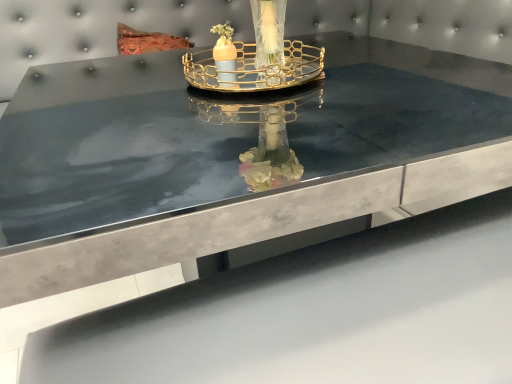
Question: Is matte orange candle at center facing towards gold metallic tray at center?

Choices:
 (A) yes
 (B) no

Answer: (B)

Question: Is matte orange candle at center wider than gold metallic tray at center?

Choices:
 (A) yes
 (B) no

Answer: (B)

Question: Considering the relative sizes of matte orange candle at center and gold metallic tray at center in the image provided, is matte orange candle at center thinner than gold metallic tray at center?

Choices:
 (A) no
 (B) yes

Answer: (B)

Question: Does matte orange candle at center have a greater height compared to gold metallic tray at center?

Choices:
 (A) no
 (B) yes

Answer: (A)

Question: Does matte orange candle at center have a smaller size compared to gold metallic tray at center?

Choices:
 (A) no
 (B) yes

Answer: (B)

Question: Is matte orange candle at center completely or partially outside of gold metallic tray at center?

Choices:
 (A) yes
 (B) no

Answer: (B)

Question: Can you confirm if gold metallic tray at center is taller than matte orange candle at center?

Choices:
 (A) no
 (B) yes

Answer: (B)

Question: Is gold metallic tray at center far from matte orange candle at center?

Choices:
 (A) no
 (B) yes

Answer: (A)

Question: Considering the relative sizes of gold metallic tray at center and matte orange candle at center in the image provided, is gold metallic tray at center wider than matte orange candle at center?

Choices:
 (A) no
 (B) yes

Answer: (B)

Question: Does gold metallic tray at center turn towards matte orange candle at center?

Choices:
 (A) no
 (B) yes

Answer: (A)

Question: Can you confirm if gold metallic tray at center is positioned to the right of matte orange candle at center?

Choices:
 (A) yes
 (B) no

Answer: (A)

Question: From the image's perspective, is gold metallic tray at center over matte orange candle at center?

Choices:
 (A) yes
 (B) no

Answer: (A)

Question: Is matte orange candle at center inside the boundaries of gold metallic tray at center, or outside?

Choices:
 (A) inside
 (B) outside

Answer: (A)